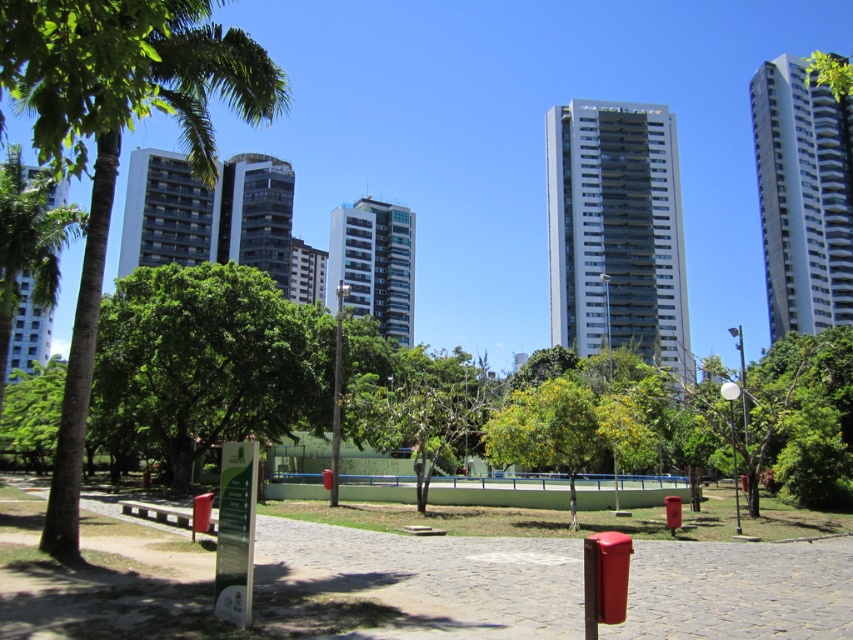
You are standing at the starting point of the cobblestone path in the urban park. You see two points marked in the scene. The first point is at coordinates point [396,592] and the second is at point [22,275]. Which point is closer to you as you face the direction the path leads?

Point [396,592] is closer to you because it is in front of point [22,275] along the path direction.

You are an architect planning to install a new sculpture between the glassy reflective building at center and the smooth glass building at center. The sculpture requires a minimum of 50 feet of space between the two buildings to be placed safely. Based on the scene description, can the sculpture be placed between them?

The glassy reflective building at center and smooth glass building at center are 53.49 feet apart from each other. Since the required minimum space is 50 feet, the sculpture can be placed between them as the distance is sufficient.

You are a visitor in the park and want to take a photo of the cobblestone path at center without the wooden park bench at lower left appearing in the background. Is it possible to do so by standing at the right position?

Yes, since the cobblestone path at center is in front of the wooden park bench at lower left, you can position yourself so that the path blocks the bench from view or stand further back to frame the shot without the bench in the background.